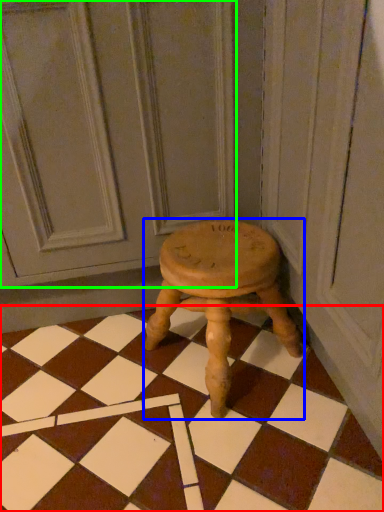
Question: Based on their relative distances, which object is farther from square (highlighted by a red box)? Choose from stool (highlighted by a blue box) and screen door (highlighted by a green box).

Choices:
 (A) stool
 (B) screen door

Answer: (B)